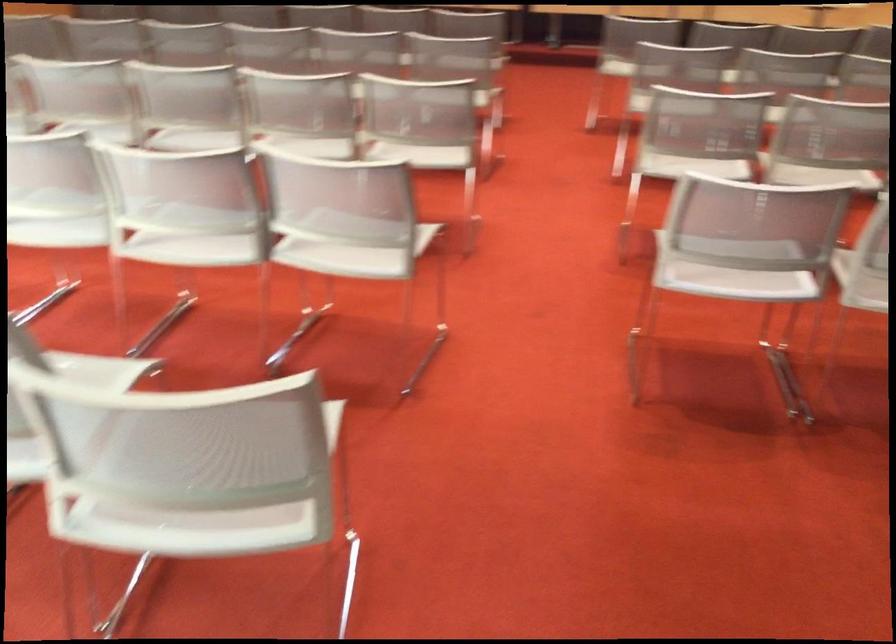
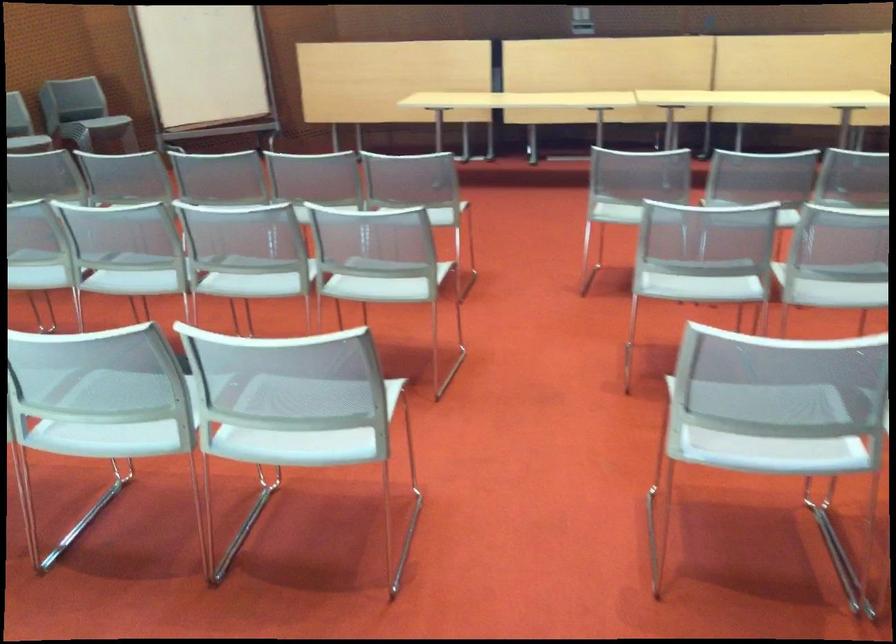
The point at (420,134) is marked in the first image. Where is the corresponding point in the second image?

(300, 415)